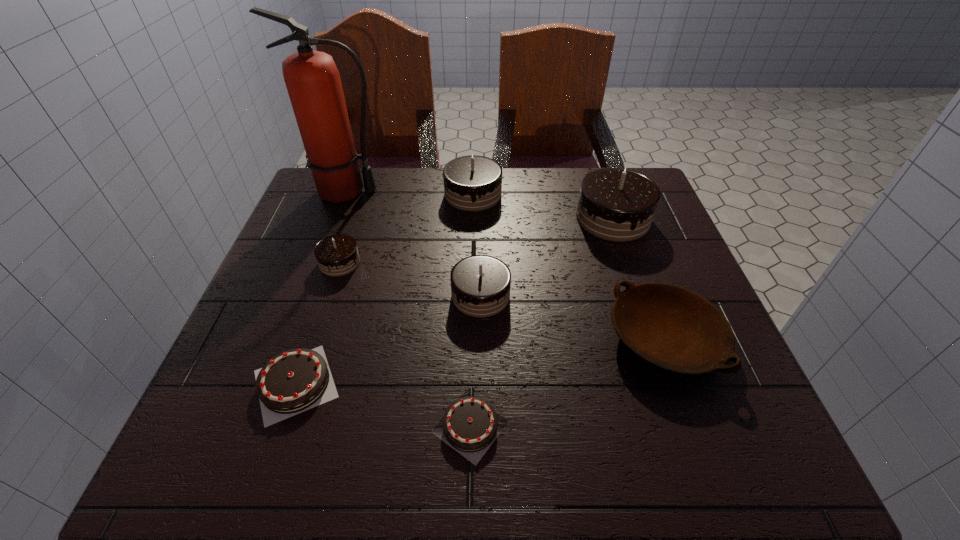
You are a GUI agent. You are given a task and a screenshot of the screen. Output one action in this format:
    pyautogui.click(x=<x>, y=<y>)
    Task: Click on the object that ranks as the second closest to the second shortest object
    The height and width of the screenshot is (540, 960).
    Given the screenshot: What is the action you would take?
    pyautogui.click(x=337, y=255)

Locate which chocolate cake is the third closest to the fifth tallest chocolate cake. Please provide its 2D coordinates. Your answer should be formatted as a tuple, i.e. [(x, y)], where the tuple contains the x and y coordinates of a point satisfying the conditions above.

[(480, 284)]

Find the location of `chocolate cake that stands as the third closest to the fifth tallest chocolate cake`. chocolate cake that stands as the third closest to the fifth tallest chocolate cake is located at coordinates (480, 284).

Find the location of a particular element. The width and height of the screenshot is (960, 540). chocolate chocolate cake that can be found as the fourth closest to the plate is located at coordinates (x=337, y=255).

The image size is (960, 540). Find the location of `chocolate chocolate cake that can be found as the fourth closest to the fire extinguisher`. chocolate chocolate cake that can be found as the fourth closest to the fire extinguisher is located at coordinates (615, 204).

The height and width of the screenshot is (540, 960). I want to click on vacant point that satisfies the following two spatial constraints: 1. on the nozzle of the fire extinguisher; 2. on the right side of the seventh tallest object, so tap(274, 383).

Where is `blank space that satisfies the following two spatial constraints: 1. on the nozzle of the sixth tallest object; 2. on the left side of the tallest object`? This screenshot has width=960, height=540. blank space that satisfies the following two spatial constraints: 1. on the nozzle of the sixth tallest object; 2. on the left side of the tallest object is located at coordinates (291, 339).

The height and width of the screenshot is (540, 960). In order to click on vacant region that satisfies the following two spatial constraints: 1. on the nozzle of the fire extinguisher; 2. on the right side of the fourth shortest object in this screenshot , I will do `click(320, 262)`.

Identify the location of vacant region that satisfies the following two spatial constraints: 1. on the back side of the second shortest chocolate cake; 2. on the right side of the brown plate. (310, 339).